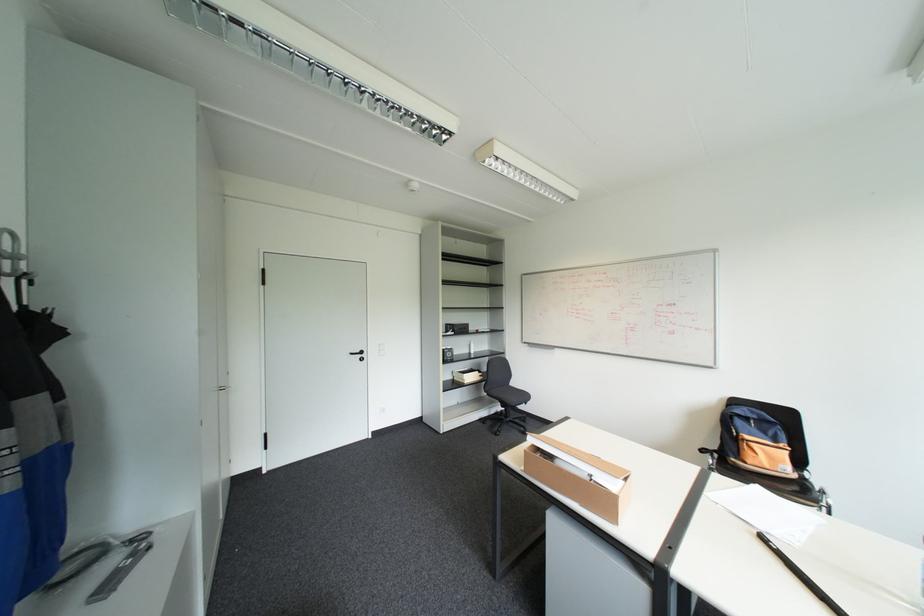
The width and height of the screenshot is (924, 616). Describe the element at coordinates (22, 289) in the screenshot. I see `the umbrella handle` at that location.